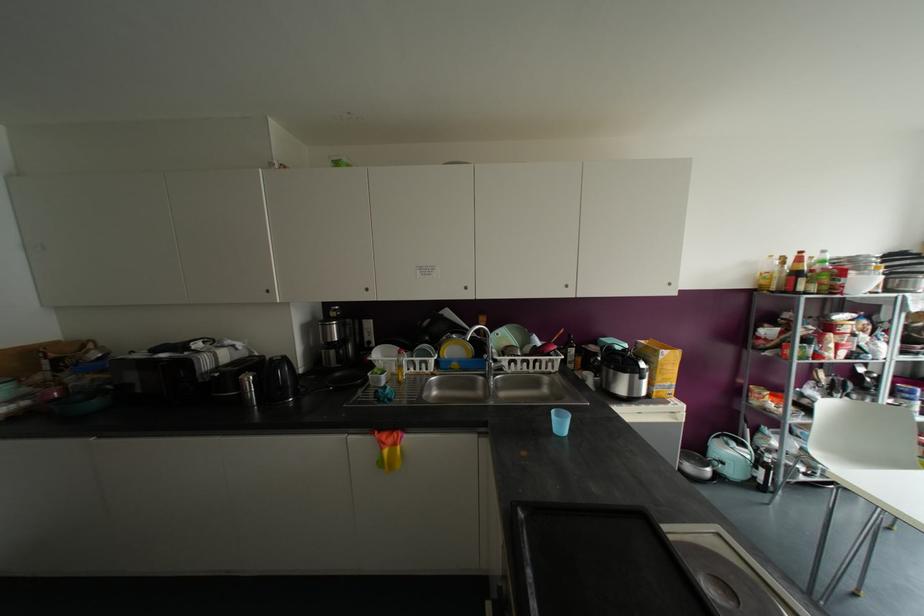
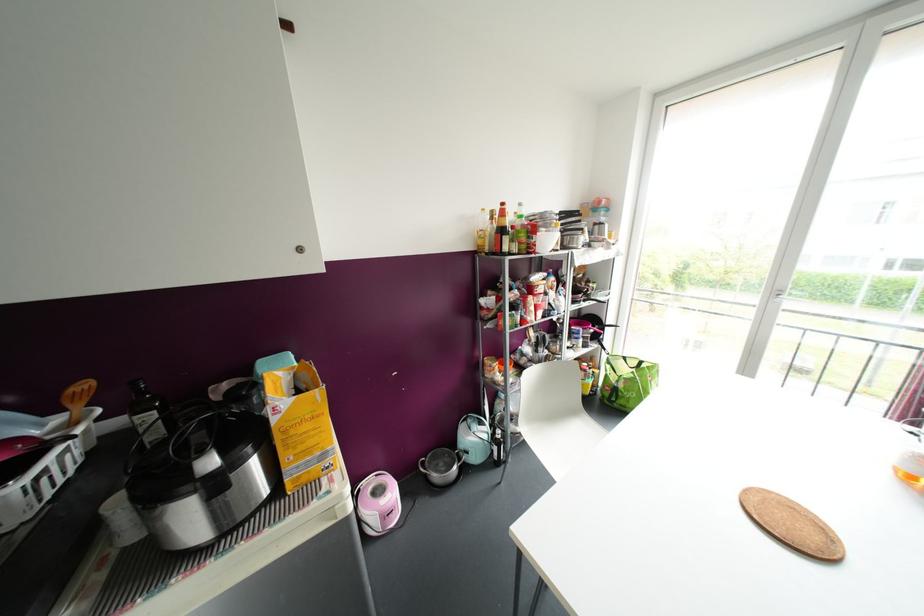
Where in the second image is the point corresponding to (861,284) from the first image?

(546, 241)